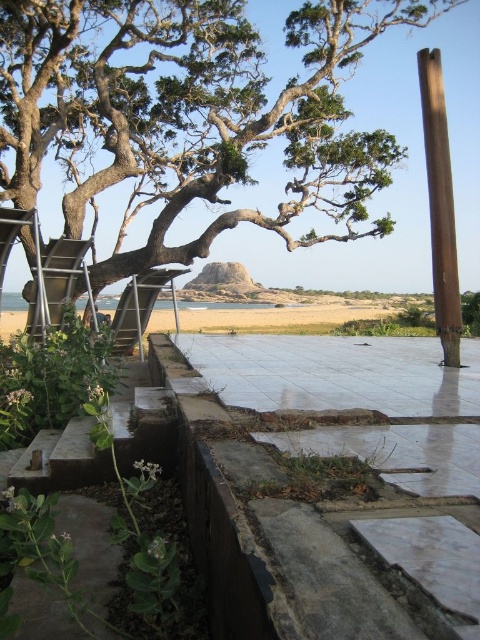
Question: Can you confirm if green leafy tree at upper left is positioned above metallic silver ladder at left?

Choices:
 (A) no
 (B) yes

Answer: (B)

Question: Which of the following is the closest to the observer?

Choices:
 (A) gray concrete at lower center
 (B) green leafy tree at upper left
 (C) metallic silver ladder at left

Answer: (A)

Question: Is brown wooden pole at right bigger than metallic silver ladder at left?

Choices:
 (A) no
 (B) yes

Answer: (B)

Question: Can you confirm if brown wooden pole at right is thinner than metallic silver ladder at left?

Choices:
 (A) yes
 (B) no

Answer: (B)

Question: Among these points, which one is farthest from the camera?

Choices:
 (A) (186, 355)
 (B) (50, 8)

Answer: (B)

Question: Which object appears closest to the camera in this image?

Choices:
 (A) brown wooden pole at right
 (B) gray concrete at lower center
 (C) metallic silver ladder at left

Answer: (B)